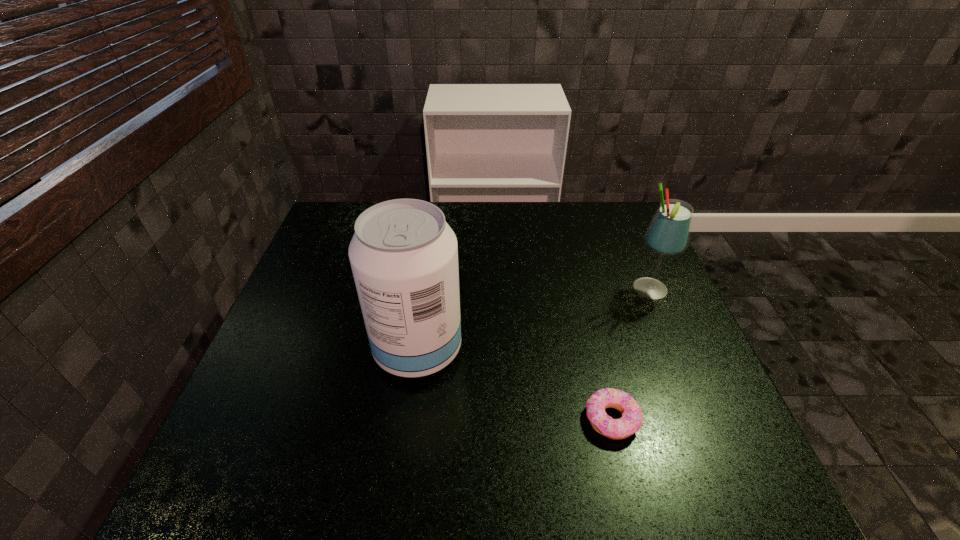
Locate an element on the screen. free space between the nearest object and the rightmost object is located at coordinates (631, 354).

The width and height of the screenshot is (960, 540). What are the coordinates of `vacant space in between the doughnut and the right alcohol` in the screenshot? It's located at (631, 354).

Find the location of `free space between the nearest object and the nearer alcohol`. free space between the nearest object and the nearer alcohol is located at coordinates (515, 384).

Where is `vacant area that lies between the shortest object and the farthest object`? This screenshot has width=960, height=540. vacant area that lies between the shortest object and the farthest object is located at coordinates (631, 354).

Where is `object that is the second nearest to the second farthest object`? object that is the second nearest to the second farthest object is located at coordinates (668, 234).

Find the location of `object that is the second closest one to the rightmost object`. object that is the second closest one to the rightmost object is located at coordinates (404, 256).

At what (x,y) coordinates should I click in order to perform the action: click on vacant space that satisfies the following two spatial constraints: 1. on the back side of the right alcohol; 2. on the left side of the left alcohol. Please return your answer as a coordinate pair (x, y). This screenshot has width=960, height=540. Looking at the image, I should click on (426, 289).

Find the location of a particular element. free space that satisfies the following two spatial constraints: 1. on the back side of the nearer alcohol; 2. on the right side of the rightmost object is located at coordinates [x=426, y=289].